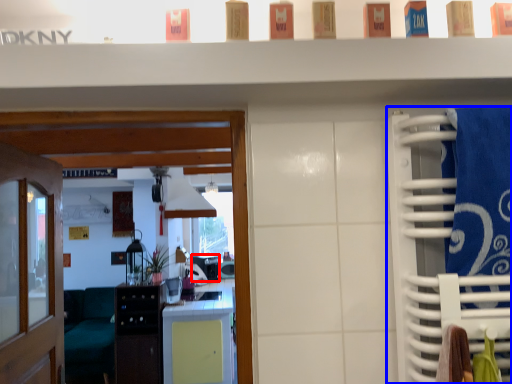
Question: Which point is further to the camera, appliance (highlighted by a red box) or closet (highlighted by a blue box)?

Choices:
 (A) appliance
 (B) closet

Answer: (A)